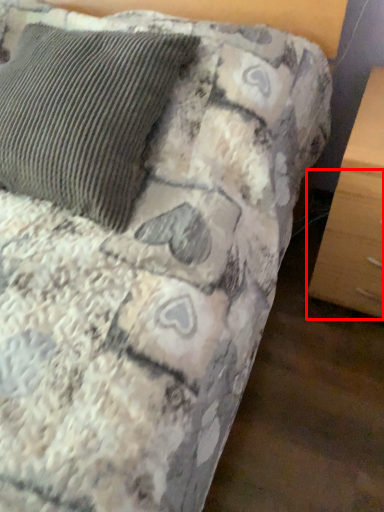
Question: Considering the relative positions of drawer (annotated by the red box) and pillow in the image provided, where is drawer (annotated by the red box) located with respect to the staircase?

Choices:
 (A) left
 (B) right

Answer: (B)